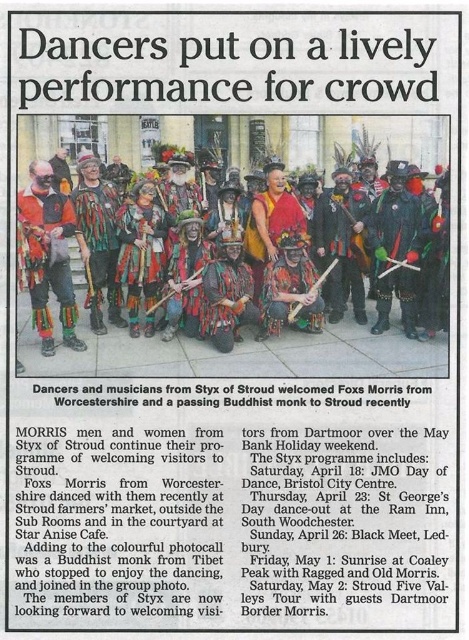
Question: Is matte multicolored costume at center positioned in front of orange fabric mask at left?

Choices:
 (A) yes
 (B) no

Answer: (A)

Question: Which of the following is the farthest from the observer?

Choices:
 (A) (36, 257)
 (B) (323, 358)

Answer: (A)

Question: Among these objects, which one is farthest from the camera?

Choices:
 (A) matte multicolored costume at center
 (B) orange fabric mask at left

Answer: (B)

Question: Does matte multicolored costume at center appear on the left side of orange fabric mask at left?

Choices:
 (A) yes
 (B) no

Answer: (B)

Question: Can you confirm if matte multicolored costume at center is thinner than orange fabric mask at left?

Choices:
 (A) yes
 (B) no

Answer: (B)

Question: Which point is farther to the camera?

Choices:
 (A) (45, 353)
 (B) (302, 346)

Answer: (B)